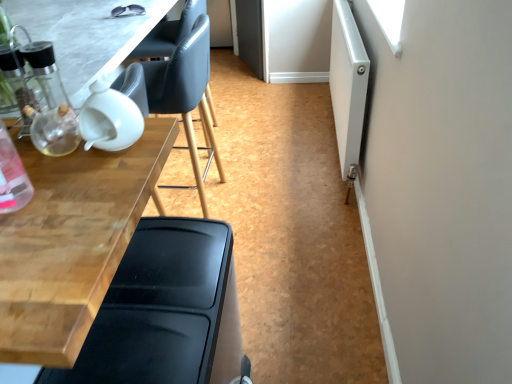
At what (x,y) coordinates should I click in order to perform the action: click on free space above black plastic chair at lower left, the second chair viewed from the back (from a real-world perspective). Please return your answer as a coordinate pair (x, y). Image resolution: width=512 pixels, height=384 pixels. Looking at the image, I should click on (155, 288).